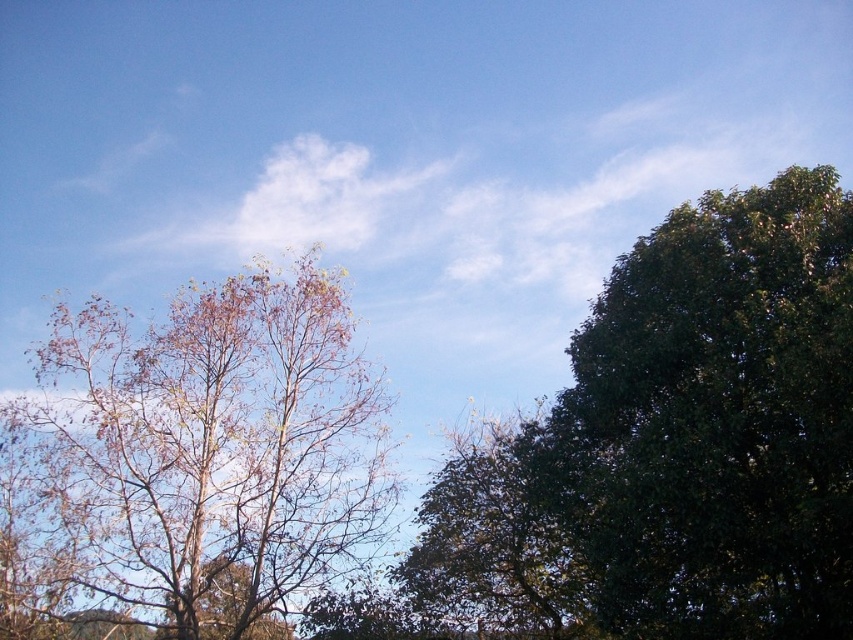
Question: Which of the following is the farthest from the observer?

Choices:
 (A) brown leafy tree at left
 (B) green leafy tree at right

Answer: (A)

Question: Can you confirm if green leafy tree at right is thinner than brown leafy tree at left?

Choices:
 (A) no
 (B) yes

Answer: (B)

Question: Is green leafy tree at right positioned in front of brown leafy tree at left?

Choices:
 (A) yes
 (B) no

Answer: (A)

Question: Which point is closer to the camera?

Choices:
 (A) green leafy tree at right
 (B) brown leafy tree at left

Answer: (A)

Question: Can you confirm if green leafy tree at right is wider than brown leafy tree at left?

Choices:
 (A) no
 (B) yes

Answer: (A)